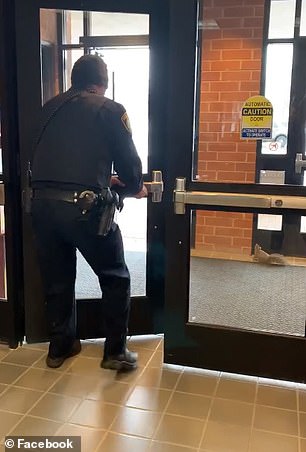
Find the location of a particular element. This screenshot has height=452, width=306. fully visible push bar on the right door is located at coordinates (226, 199).